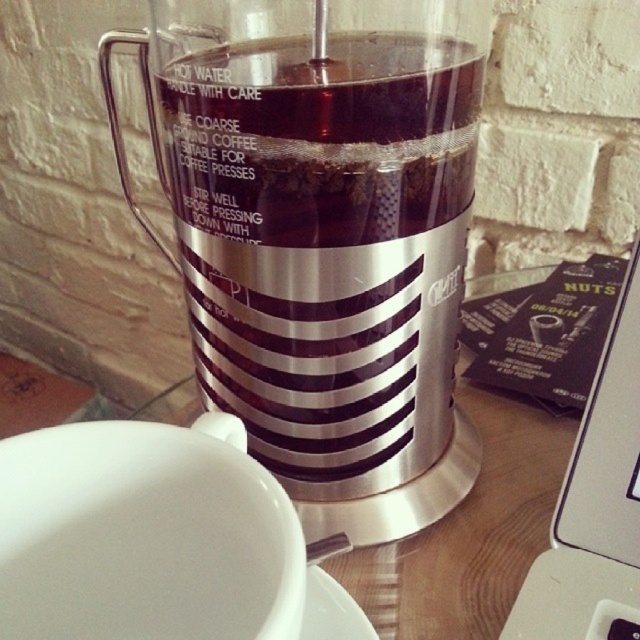
Question: Can you confirm if satin silver blender at center is thinner than white ceramic saucer at lower center?

Choices:
 (A) no
 (B) yes

Answer: (A)

Question: Is satin silver blender at center closer to camera compared to black plastic laptop at lower right?

Choices:
 (A) yes
 (B) no

Answer: (A)

Question: Does satin silver blender at center appear under white ceramic saucer at lower center?

Choices:
 (A) yes
 (B) no

Answer: (B)

Question: Among these objects, which one is nearest to the camera?

Choices:
 (A) white ceramic saucer at lower center
 (B) satin silver blender at center
 (C) black plastic laptop at lower right

Answer: (A)

Question: Which object appears farthest from the camera in this image?

Choices:
 (A) white ceramic saucer at lower center
 (B) black plastic laptop at lower right
 (C) satin silver blender at center

Answer: (B)

Question: Which point is closer to the camera?

Choices:
 (A) (620, 305)
 (B) (317, 113)
 (C) (364, 618)

Answer: (B)